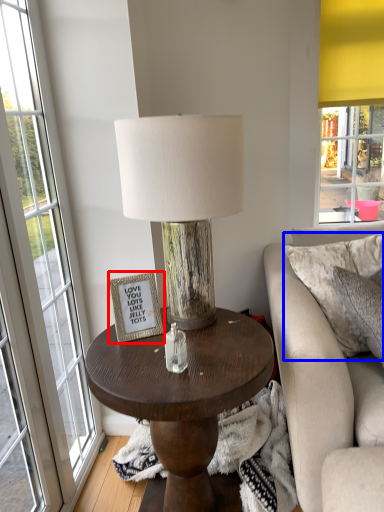
Question: Which point is closer to the camera, picture frame (highlighted by a red box) or pillow (highlighted by a blue box)?

Choices:
 (A) picture frame
 (B) pillow

Answer: (A)